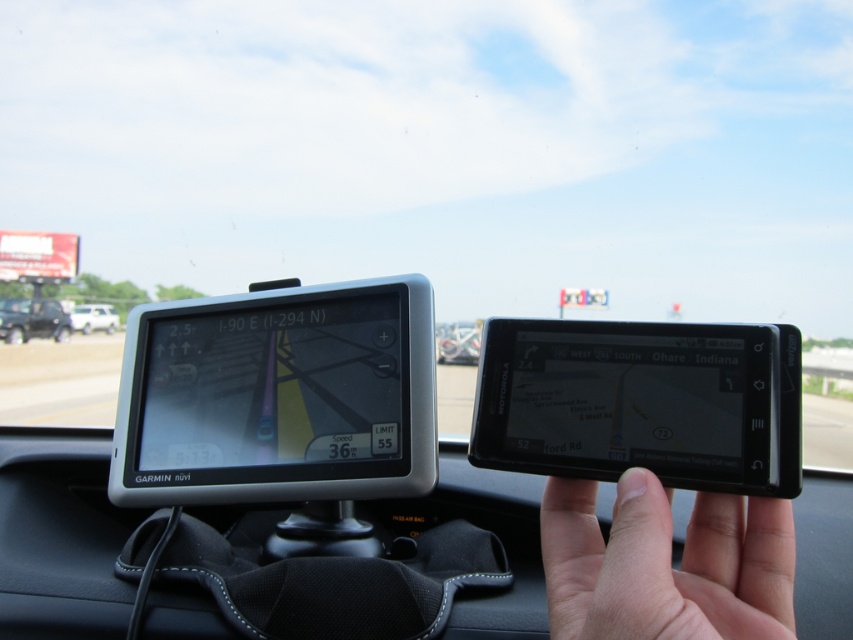
You are driving a car and see the metallic silver car at center and the white matte car at left. Which car is closer to you?

The metallic silver car at center is closer to you because it is in front of the white matte car at left.

You are a passenger in the metallic silver car at center and want to exit the vehicle. Which direction should you look to see the white matte car at left?

The metallic silver car at center is to the right of the white matte car at left, so you should look to your left to see the white matte car at left.

You are driving and want to check the GPS. Is the black glossy tablet at center positioned higher than the skinny white hand at center?

Yes, the black glossy tablet at center is above the skinny white hand at center.